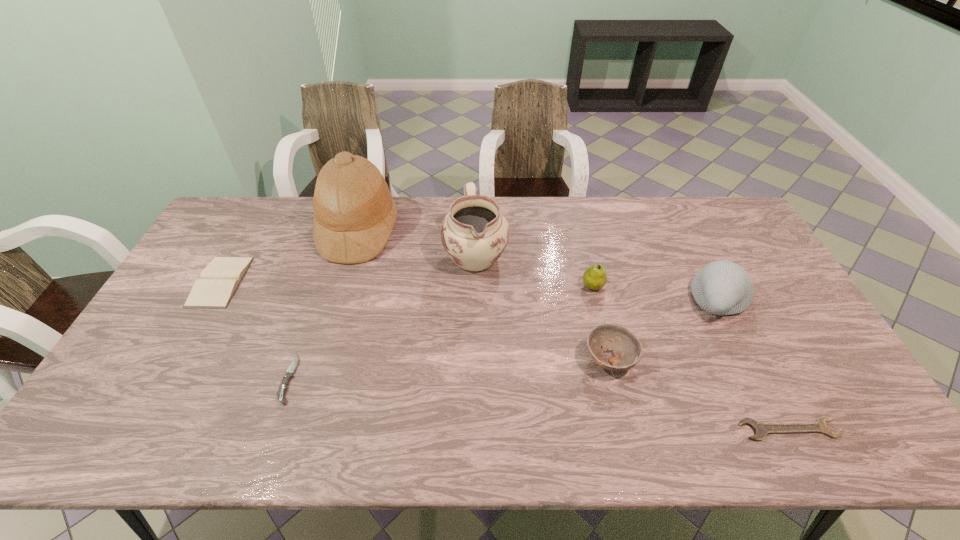
Where is `the tallest object`? the tallest object is located at coordinates (354, 213).

Locate an element on the screen. This screenshot has width=960, height=540. the second tallest object is located at coordinates click(x=474, y=233).

Where is `pitcher`? The height and width of the screenshot is (540, 960). pitcher is located at coordinates (474, 233).

Identify the location of the third tallest object. (722, 287).

This screenshot has width=960, height=540. I want to click on the fourth tallest object, so click(595, 277).

Find the location of a particular element. Image resolution: width=960 pixels, height=540 pixels. the fifth tallest object is located at coordinates (627, 348).

The width and height of the screenshot is (960, 540). In order to click on Bible in this screenshot , I will do `click(219, 280)`.

At what (x,y) coordinates should I click in order to perform the action: click on the leftmost object. Please return your answer as a coordinate pair (x, y). This screenshot has width=960, height=540. Looking at the image, I should click on point(219,280).

Where is `pocketknife`? pocketknife is located at coordinates (288, 375).

This screenshot has height=540, width=960. I want to click on the shortest object, so click(x=760, y=429).